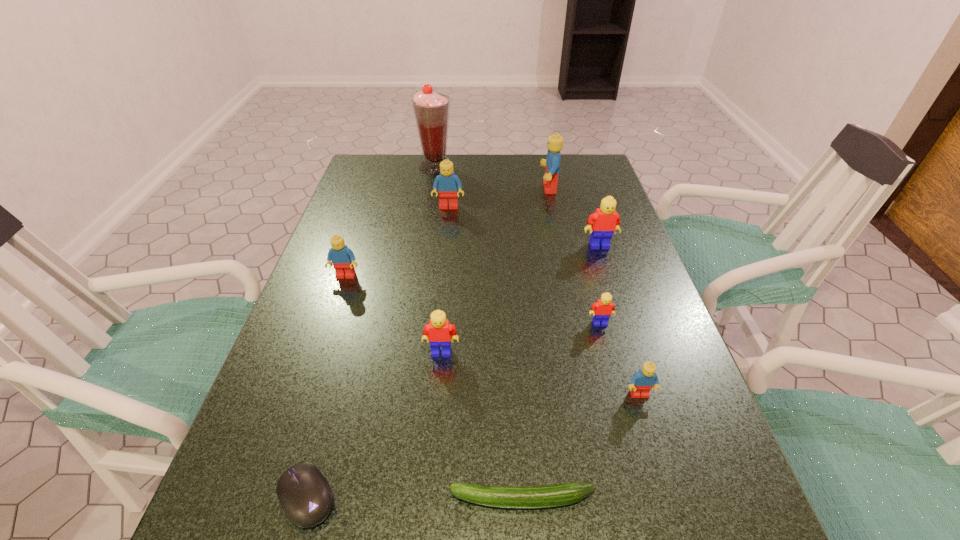
This screenshot has height=540, width=960. What are the coordinates of `blank area located on the front-facing side of the shortest object` in the screenshot? It's located at (387, 499).

You are a GUI agent. You are given a task and a screenshot of the screen. Output one action in this format:
    pyautogui.click(x=<x>, y=<y>)
    Task: Click on the vacant space located on the front-facing side of the shortest object
    
    Given the screenshot: What is the action you would take?
    pyautogui.click(x=368, y=499)

Where is `vacant space located on the front-facing side of the shortest object`? This screenshot has height=540, width=960. vacant space located on the front-facing side of the shortest object is located at coordinates (242, 499).

The width and height of the screenshot is (960, 540). Identify the location of smoothie present at the far edge. (431, 110).

The image size is (960, 540). Find the location of `Lego at the far edge`. Lego at the far edge is located at coordinates (555, 142).

At what (x,y) coordinates should I click in order to perform the action: click on Lego that is positioned at the left edge. Please return your answer as a coordinate pair (x, y). The image size is (960, 540). Looking at the image, I should click on (342, 258).

You are a GUI agent. You are given a task and a screenshot of the screen. Output one action in this format:
    pyautogui.click(x=<x>, y=<y>)
    Task: Click on the computer mouse positioned at the left edge
    The width and height of the screenshot is (960, 540).
    Given the screenshot: What is the action you would take?
    pyautogui.click(x=305, y=495)

This screenshot has height=540, width=960. Identify the location of blank space at the far edge of the desktop. (483, 185).

Where is `free region at the left edge of the desktop`? Image resolution: width=960 pixels, height=540 pixels. free region at the left edge of the desktop is located at coordinates (333, 339).

Identify the location of vacant space at the right edge of the desktop. The image size is (960, 540). (686, 485).